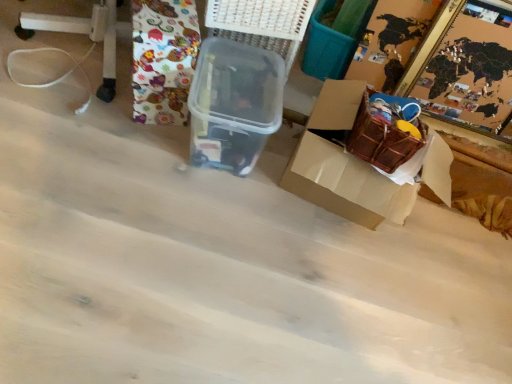
The width and height of the screenshot is (512, 384). I want to click on free region on the left part of patterned fabric at upper left, so click(x=94, y=83).